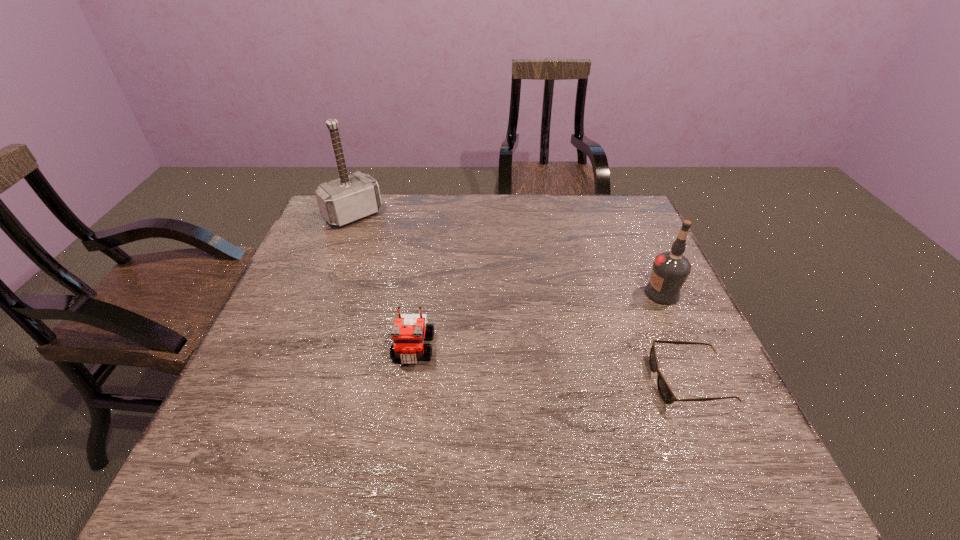
Identify the location of vacant spot on the desktop that is between the second object from left to right and the shortest object and is positioned for striking with the head of the leftmost object. (507, 360).

Where is `free space on the desktop that is between the Lego and the shortest object and is positioned on the front label of the vodka`? free space on the desktop that is between the Lego and the shortest object and is positioned on the front label of the vodka is located at coordinates (516, 361).